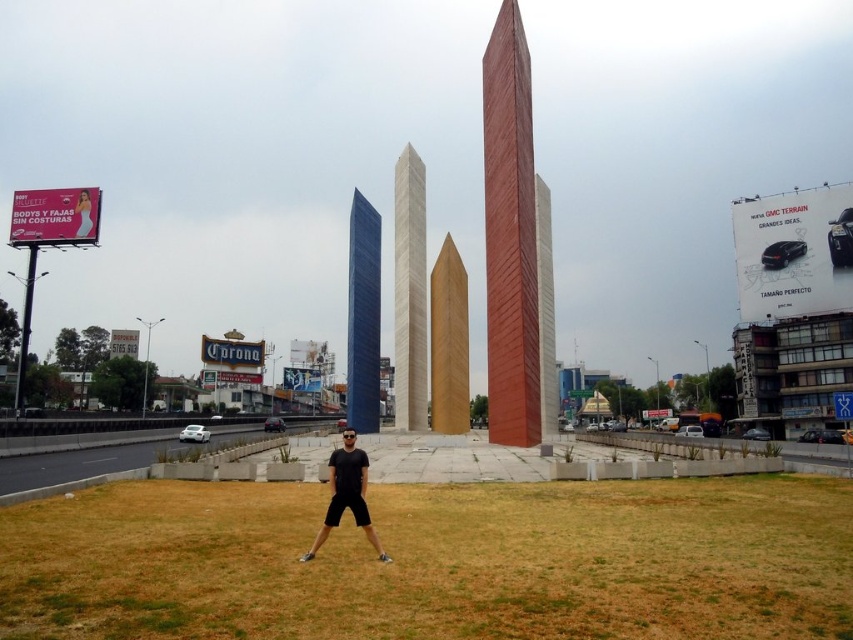
You are standing at the point marked as point (509,236) in the image. What architectural structure are you facing? Please name it using the object label from the scene description.

The point (509,236) corresponds to the smooth reddish brown tower at center, so you are facing the smooth reddish brown tower at center.